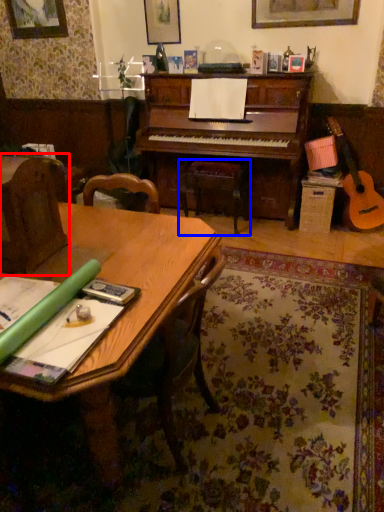
Question: Which object is further to the camera taking this photo, armchair (highlighted by a red box) or music stool (highlighted by a blue box)?

Choices:
 (A) armchair
 (B) music stool

Answer: (B)